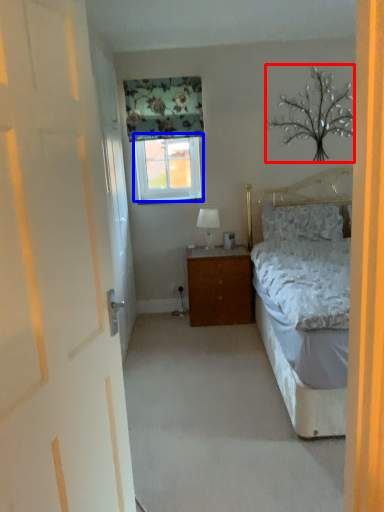
Question: Which of the following is the closest to the observer, tree (highlighted by a red box) or window (highlighted by a blue box)?

Choices:
 (A) tree
 (B) window

Answer: (A)